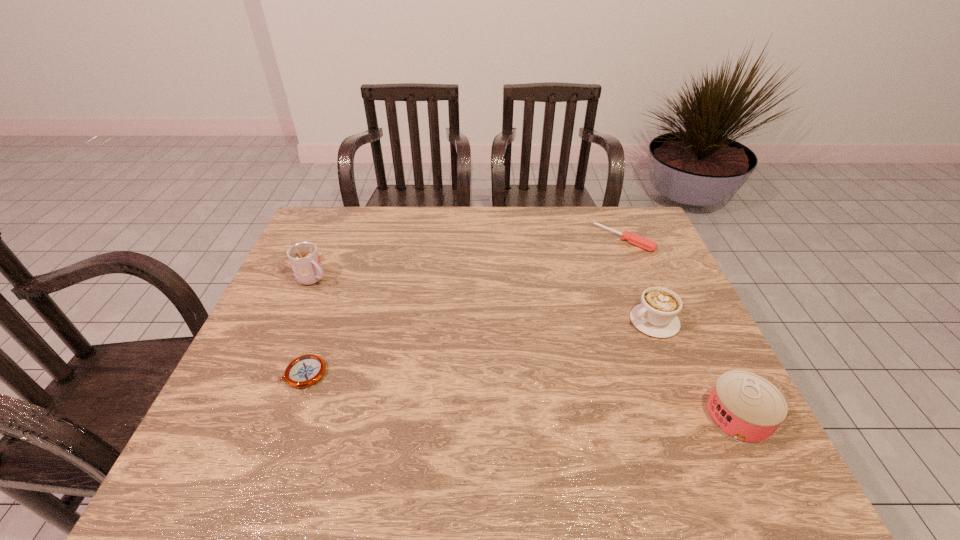
Locate an element on the screen. free region located to the right of the third nearest object's handle is located at coordinates (574, 358).

Where is `vacant region located 0.280m to the right of the third nearest object's handle`? This screenshot has height=540, width=960. vacant region located 0.280m to the right of the third nearest object's handle is located at coordinates (547, 370).

Find the location of a particular element. Image resolution: width=960 pixels, height=540 pixels. vacant space located to the right of the third nearest object's handle is located at coordinates (593, 349).

The width and height of the screenshot is (960, 540). What are the coordinates of `free point located 0.380m at the tip of the fourth tallest object` in the screenshot? It's located at (543, 314).

You are a GUI agent. You are given a task and a screenshot of the screen. Output one action in this format:
    pyautogui.click(x=<x>, y=<y>)
    Task: Click on the vacant region located 0.080m at the tip of the fourth tallest object
    The height and width of the screenshot is (540, 960).
    Given the screenshot: What is the action you would take?
    pyautogui.click(x=598, y=262)

Find the location of a particular element. The width and height of the screenshot is (960, 540). vacant region located at the tip of the fourth tallest object is located at coordinates (581, 278).

Where is `free space located on the side with the handle of the cup`? free space located on the side with the handle of the cup is located at coordinates (424, 352).

Find the location of a particular element. The height and width of the screenshot is (540, 960). free location located 0.320m on the side with the handle of the cup is located at coordinates (402, 337).

The height and width of the screenshot is (540, 960). I want to click on vacant space positioned 0.270m on the side with the handle of the cup, so click(389, 328).

Where is `object at the far edge`? This screenshot has width=960, height=540. object at the far edge is located at coordinates (644, 243).